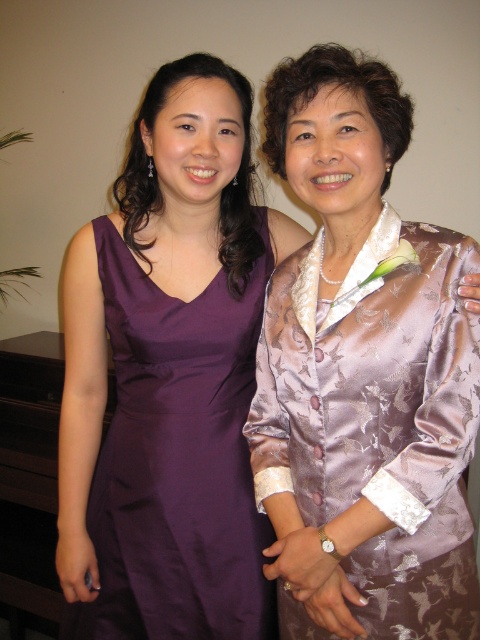
Question: Where is silky purple dress at center located in relation to purple satin dress at left in the image?

Choices:
 (A) above
 (B) below

Answer: (A)

Question: Which point is farther to the camera?

Choices:
 (A) purple satin dress at left
 (B) silky purple dress at center

Answer: (A)

Question: Does silky purple dress at center come in front of purple satin dress at left?

Choices:
 (A) no
 (B) yes

Answer: (B)

Question: Can you confirm if silky purple dress at center is wider than purple satin dress at left?

Choices:
 (A) yes
 (B) no

Answer: (B)